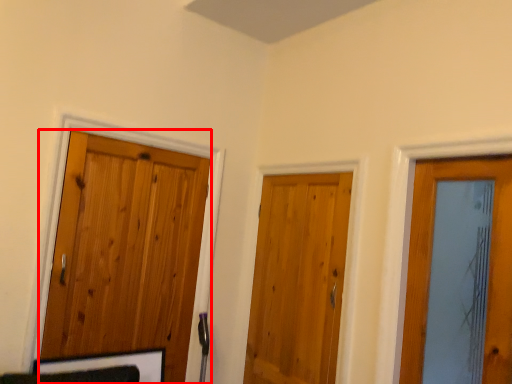
Question: From the image's perspective, what is the correct spatial positioning of door (annotated by the red box) in reference to door?

Choices:
 (A) below
 (B) above

Answer: (B)